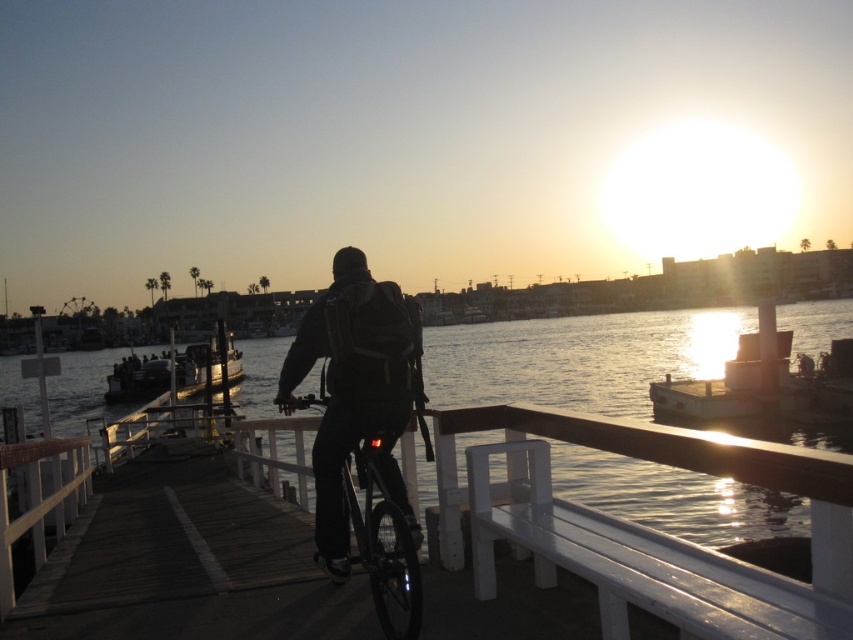
You are a photographer trying to capture the sunset scene. You notice the black matte backpack at center and the shiny black bicycle at center. Which object is closer to the camera, based on their positions?

The black matte backpack at center is closer to the camera because the shiny black bicycle at center is positioned behind it.

You are a photographer planning to take a picture of the waterfront scene. You want to focus on the black matte backpack at center. Where exactly should you aim your camera to capture it?

The black matte backpack at center is located at coordinates point (354, 388), so aim your camera there to capture it.